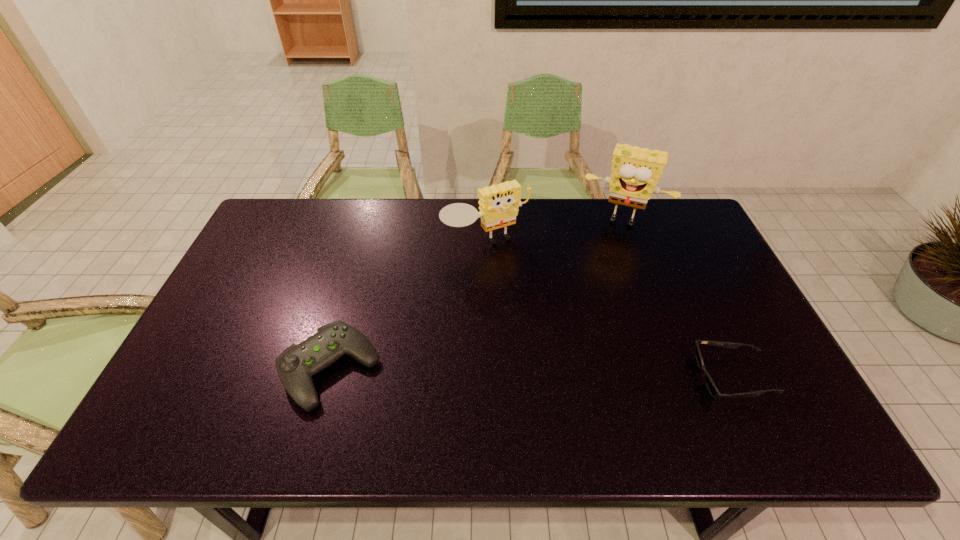
I want to click on object that is the second closest to the third tallest object, so click(x=635, y=171).

In order to click on vacant area in the image that satisfies the following two spatial constraints: 1. on the front side of the sunglasses; 2. on the front-facing side of the second shortest object in this screenshot , I will do `click(327, 377)`.

Identify the location of free region that satisfies the following two spatial constraints: 1. on the front side of the sunglasses; 2. on the front-facing side of the leftmost object. The image size is (960, 540). (327, 377).

The width and height of the screenshot is (960, 540). In order to click on vacant space that satisfies the following two spatial constraints: 1. on the front side of the shortest object; 2. on the front-facing side of the leftmost object in this screenshot , I will do `click(327, 377)`.

What are the coordinates of `free space in the image that satisfies the following two spatial constraints: 1. on the back side of the control; 2. on the left side of the third object from right to left` in the screenshot? It's located at (365, 244).